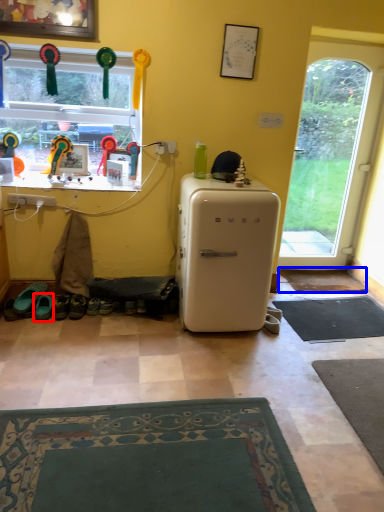
Question: Among these objects, which one is farthest to the camera, footwear (highlighted by a red box) or mat (highlighted by a blue box)?

Choices:
 (A) footwear
 (B) mat

Answer: (B)